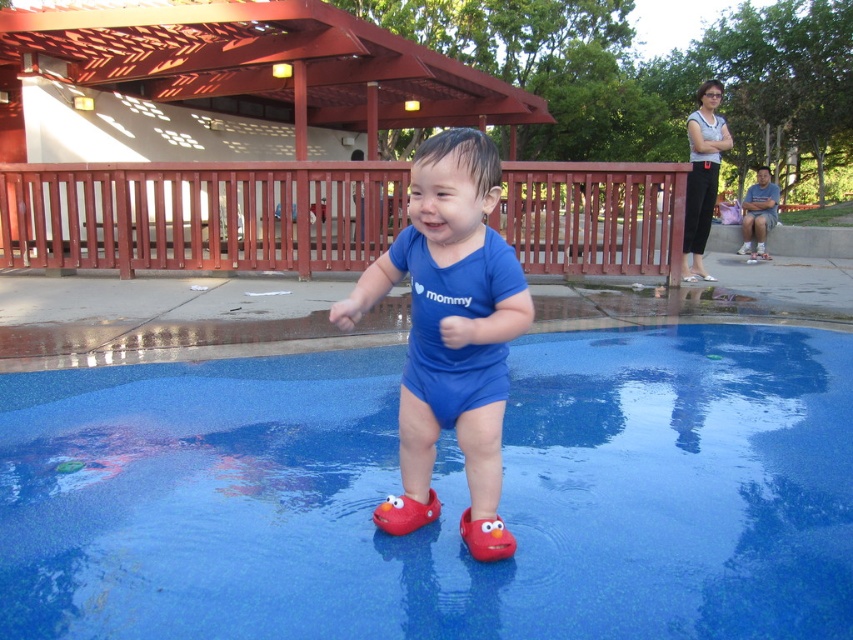
Question: Does blue matte onesie at center appear under rubber/soft shoe at center?

Choices:
 (A) no
 (B) yes

Answer: (A)

Question: Does blue textured pool at center appear on the left side of rubber/soft shoe at center?

Choices:
 (A) no
 (B) yes

Answer: (A)

Question: Is blue textured pool at center closer to the viewer compared to blue cotton shirt at center?

Choices:
 (A) yes
 (B) no

Answer: (A)

Question: Considering the real-world distances, which object is farthest from the blue textured pool at center?

Choices:
 (A) blue matte onesie at center
 (B) blue cotton shirt at center
 (C) rubber elmo shoe at center
 (D) rubber/soft shoe at center

Answer: (B)

Question: Which point is closer to the camera taking this photo?

Choices:
 (A) (498, 534)
 (B) (119, 451)

Answer: (A)

Question: Which object is farther from the camera taking this photo?

Choices:
 (A) rubber elmo shoe at center
 (B) rubber/soft shoe at center
 (C) blue cotton shirt at center

Answer: (C)